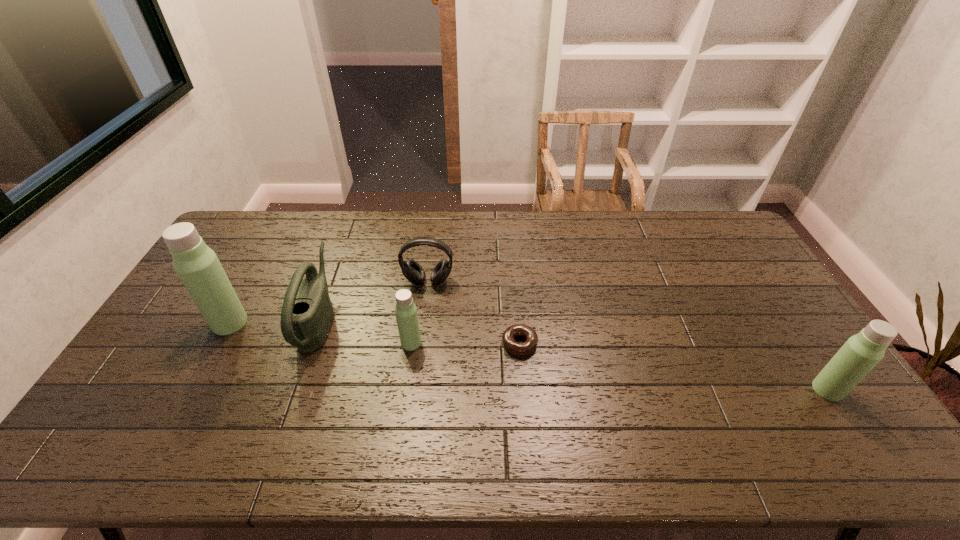
At what (x,y) coordinates should I click in order to perform the action: click on vacant region located on the back of the shortest thermos bottle. Please return your answer as a coordinate pair (x, y). The height and width of the screenshot is (540, 960). Looking at the image, I should click on (415, 320).

Locate an element on the screen. free space located on the left of the nearest object is located at coordinates (787, 390).

Locate an element on the screen. This screenshot has height=540, width=960. vacant position located on the earcups of the headset is located at coordinates 417,376.

You are a GUI agent. You are given a task and a screenshot of the screen. Output one action in this format:
    pyautogui.click(x=<x>, y=<y>)
    Task: Click on the vacant position located on the front of the second object from right to left
    
    Given the screenshot: What is the action you would take?
    pyautogui.click(x=522, y=375)

I want to click on vacant space located on the spout of the second object from left to right, so click(364, 320).

Where is `object situated at the near edge`? The image size is (960, 540). object situated at the near edge is located at coordinates (862, 352).

Find the location of a particular element. This screenshot has height=540, width=960. object at the left edge is located at coordinates (198, 267).

Locate an element on the screen. The image size is (960, 540). object situated at the right edge is located at coordinates (862, 352).

Find the location of a particular element. object at the near right corner is located at coordinates (862, 352).

Image resolution: width=960 pixels, height=540 pixels. In the image, there is a desktop. In order to click on free space at the far edge in this screenshot , I will do `click(614, 212)`.